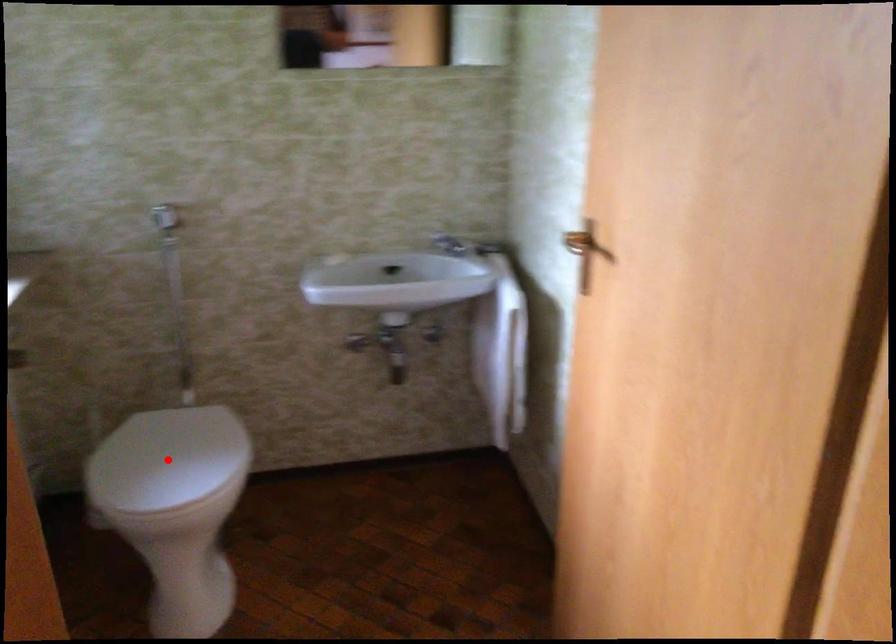
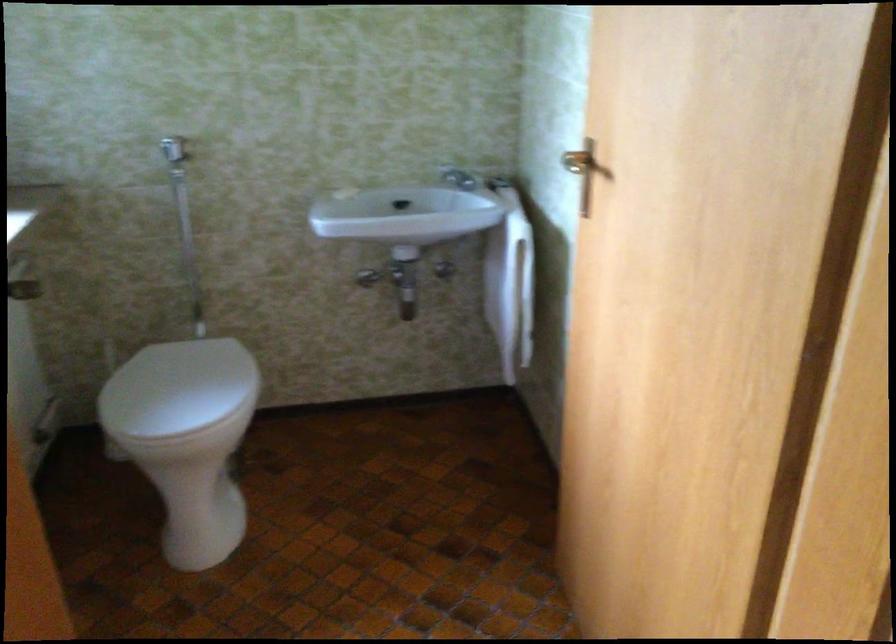
Locate, in the second image, the point that corresponds to the highlighted location in the first image.

(177, 388)